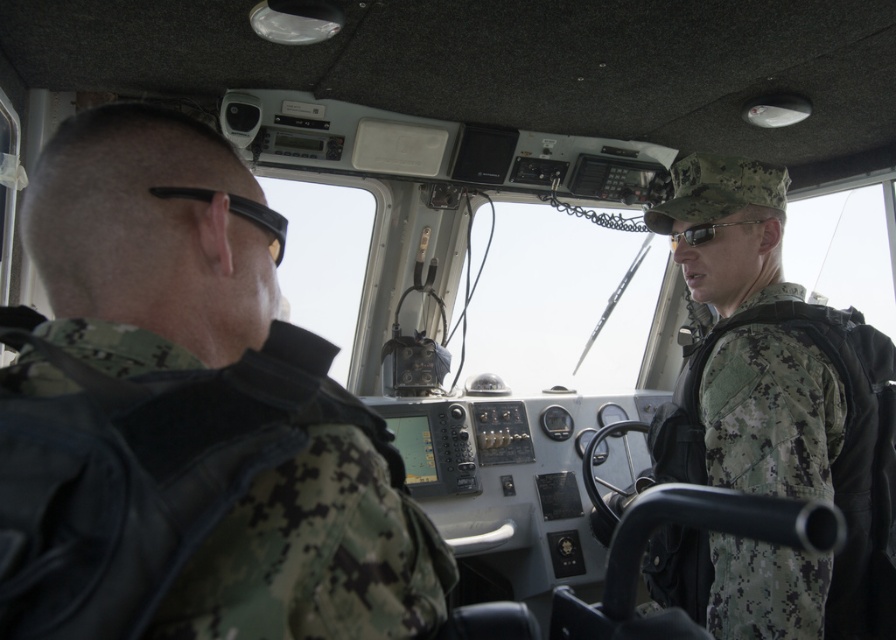
Can you confirm if camouflage uniform at left is positioned to the right of sunglasses at center?

Incorrect, camouflage uniform at left is not on the right side of sunglasses at center.

Does point (126, 419) come closer to viewer compared to point (704, 228)?

Yes.

Locate an element on the screen. This screenshot has height=640, width=896. camouflage uniform at left is located at coordinates (186, 419).

Locate an element on the screen. Image resolution: width=896 pixels, height=640 pixels. camouflage uniform at left is located at coordinates (186, 419).

Who is shorter, black rubber goggles at left or sunglasses at center?

Standing shorter between the two is black rubber goggles at left.

Which is more to the left, black rubber goggles at left or sunglasses at center?

From the viewer's perspective, black rubber goggles at left appears more on the left side.

Where is `black rubber goggles at left`? black rubber goggles at left is located at coordinates (263, 221).

Identify the location of black rubber goggles at left. (263, 221).

Who is lower down, camouflage uniform at left or camouflage uniform at center?

camouflage uniform at center

In the scene shown: Does camouflage uniform at left have a greater height compared to camouflage uniform at center?

Incorrect, camouflage uniform at left's height is not larger of camouflage uniform at center's.

Describe the element at coordinates (186, 419) in the screenshot. Image resolution: width=896 pixels, height=640 pixels. I see `camouflage uniform at left` at that location.

You are a GUI agent. You are given a task and a screenshot of the screen. Output one action in this format:
    pyautogui.click(x=<x>, y=<y>)
    Task: Click on the camouflage uniform at left
    
    Given the screenshot: What is the action you would take?
    pyautogui.click(x=186, y=419)